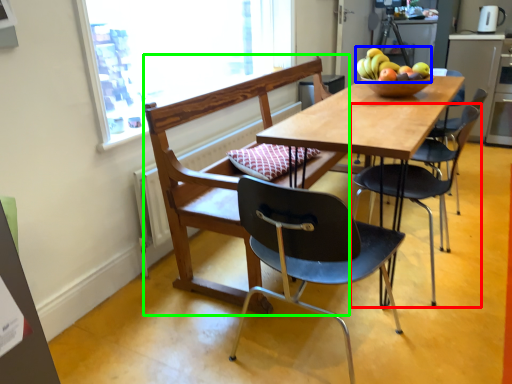
Question: Based on their relative distances, which object is farther from chair (highlighted by a red box)? Choose from fruit (highlighted by a blue box) and chair (highlighted by a green box).

Choices:
 (A) fruit
 (B) chair

Answer: (B)